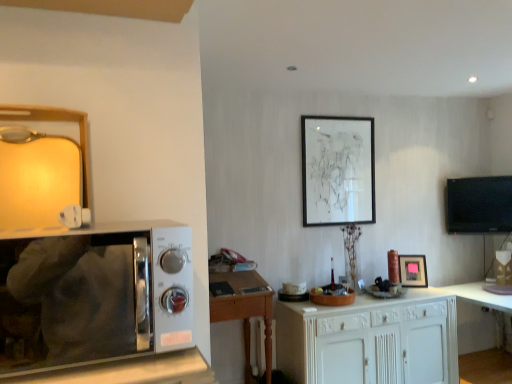
Locate an element on the screen. space that is in front of matte black picture frame at center, which is the 1th picture frame in right-to-left order is located at coordinates (426, 295).